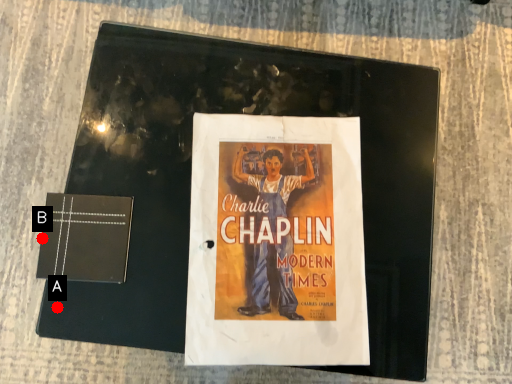
Question: Two points are circled on the image, labeled by A and B beside each circle. Which point appears closest to the camera in this image?

Choices:
 (A) A is closer
 (B) B is closer

Answer: (B)